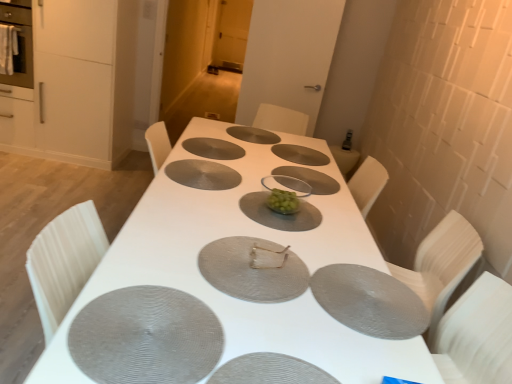
Identify the location of free space to the back side of gray textured placemat at lower right, which is the sixth pizza pan in back-to-front order. Image resolution: width=512 pixels, height=384 pixels. (330, 238).